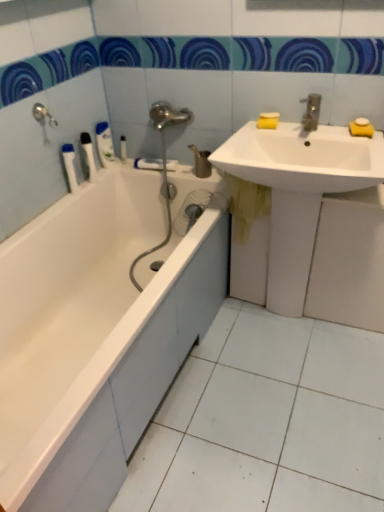
Question: Is yellow sponge at upper right, which appears as the 3th soap when viewed from the left, taller than white plastic toothbrush at left, which is the third toiletry from right to left?

Choices:
 (A) yes
 (B) no

Answer: (B)

Question: Does yellow sponge at upper right, the first soap positioned from the right, have a greater width compared to white plastic toothbrush at left, which is the third toiletry from right to left?

Choices:
 (A) yes
 (B) no

Answer: (B)

Question: Is yellow sponge at upper right, which appears as the 3th soap when viewed from the left, further to camera compared to white plastic toothbrush at left, which is the third toiletry from right to left?

Choices:
 (A) no
 (B) yes

Answer: (A)

Question: Considering the relative positions of yellow sponge at upper right, the first soap positioned from the right, and white plastic toothbrush at left, which ranks as the 2th toiletry in left-to-right order, in the image provided, is yellow sponge at upper right, the first soap positioned from the right, in front of white plastic toothbrush at left, which ranks as the 2th toiletry in left-to-right order,?

Choices:
 (A) no
 (B) yes

Answer: (B)

Question: Is yellow sponge at upper right, the first soap positioned from the right, thinner than white plastic toothbrush at left, which is the third toiletry from right to left?

Choices:
 (A) yes
 (B) no

Answer: (A)

Question: From a real-world perspective, is yellow sponge at upper right, the first soap positioned from the right, positioned under white plastic toothbrush at left, which ranks as the 2th toiletry in left-to-right order, based on gravity?

Choices:
 (A) no
 (B) yes

Answer: (A)

Question: Is white plastic toothbrush at left, which ranks as the 2th toiletry in left-to-right order, shorter than yellow matte soap at upper right, the 3th soap positioned from the right?

Choices:
 (A) yes
 (B) no

Answer: (B)

Question: Is white plastic toothbrush at left, which is the third toiletry from right to left, far from yellow matte soap at upper right, the 1th soap when ordered from left to right?

Choices:
 (A) no
 (B) yes

Answer: (A)

Question: Does white plastic toothbrush at left, which is the third toiletry from right to left, have a larger size compared to yellow matte soap at upper right, the 1th soap when ordered from left to right?

Choices:
 (A) no
 (B) yes

Answer: (B)

Question: From a real-world perspective, is white plastic toothbrush at left, which ranks as the 2th toiletry in left-to-right order, located higher than yellow matte soap at upper right, the 3th soap positioned from the right?

Choices:
 (A) no
 (B) yes

Answer: (A)

Question: Can you see white plastic toothbrush at left, which ranks as the 2th toiletry in left-to-right order, touching yellow matte soap at upper right, the 3th soap positioned from the right?

Choices:
 (A) yes
 (B) no

Answer: (B)

Question: Considering the relative positions of white plastic toothbrush at left, which is the third toiletry from right to left, and yellow matte soap at upper right, the 3th soap positioned from the right, in the image provided, is white plastic toothbrush at left, which is the third toiletry from right to left, to the right of yellow matte soap at upper right, the 3th soap positioned from the right, from the viewer's perspective?

Choices:
 (A) no
 (B) yes

Answer: (A)

Question: Does white plastic tube at upper left, which is counted as the fourth toiletry, starting from the left, have a larger size compared to white glossy bathtub at left?

Choices:
 (A) no
 (B) yes

Answer: (A)